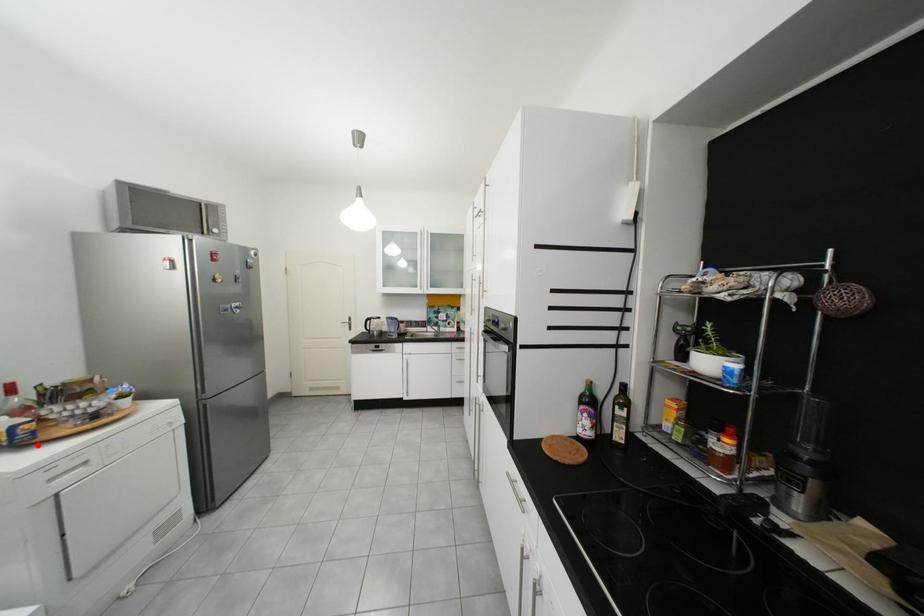
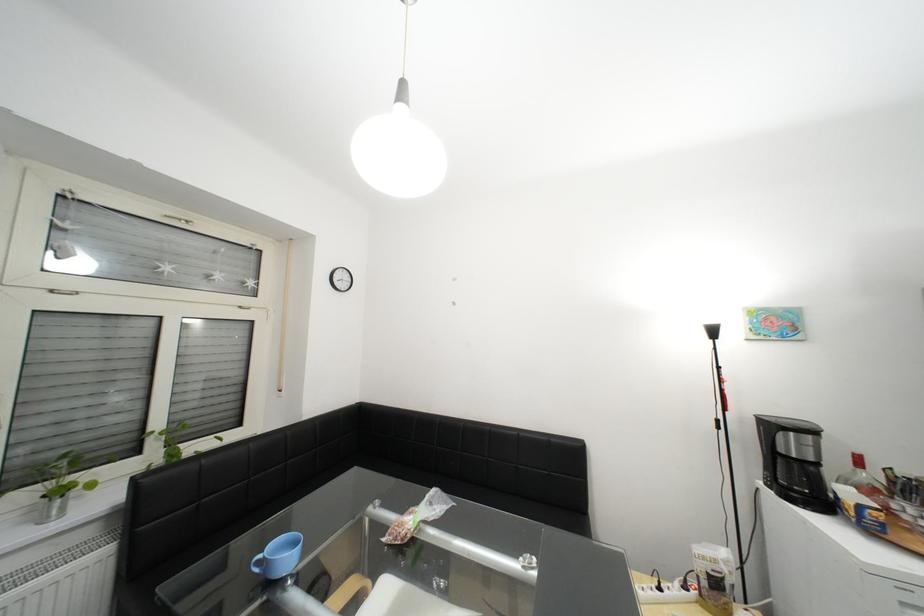
In the second image, find the point that corresponds to the highlighted location in the first image.

(886, 533)